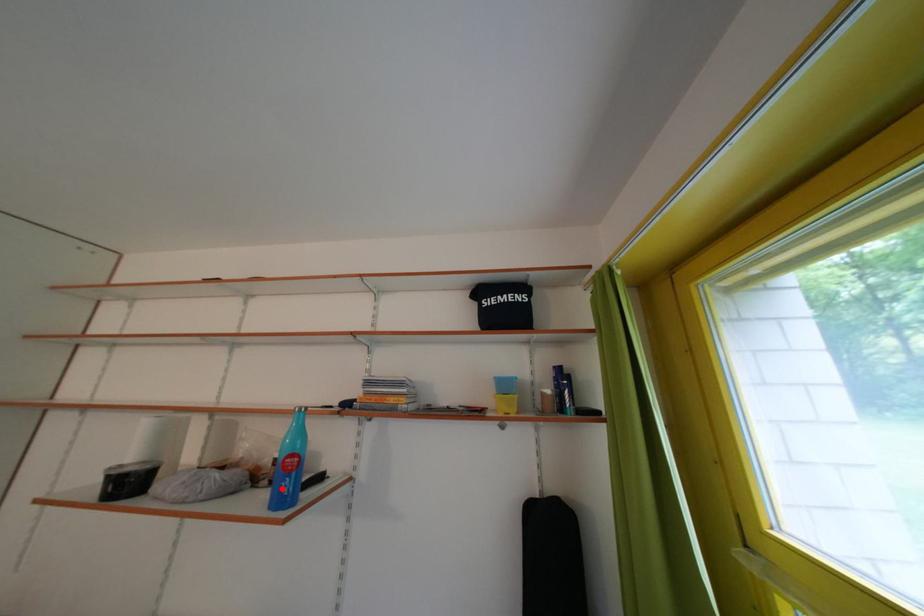
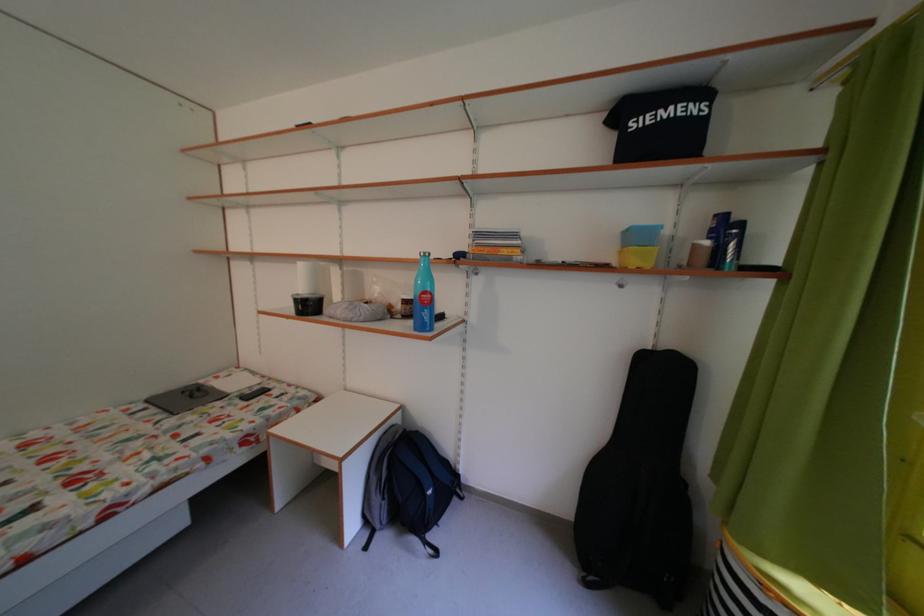
The point at the highlighted location is marked in the first image. Where is the corresponding point in the second image?

(416, 322)